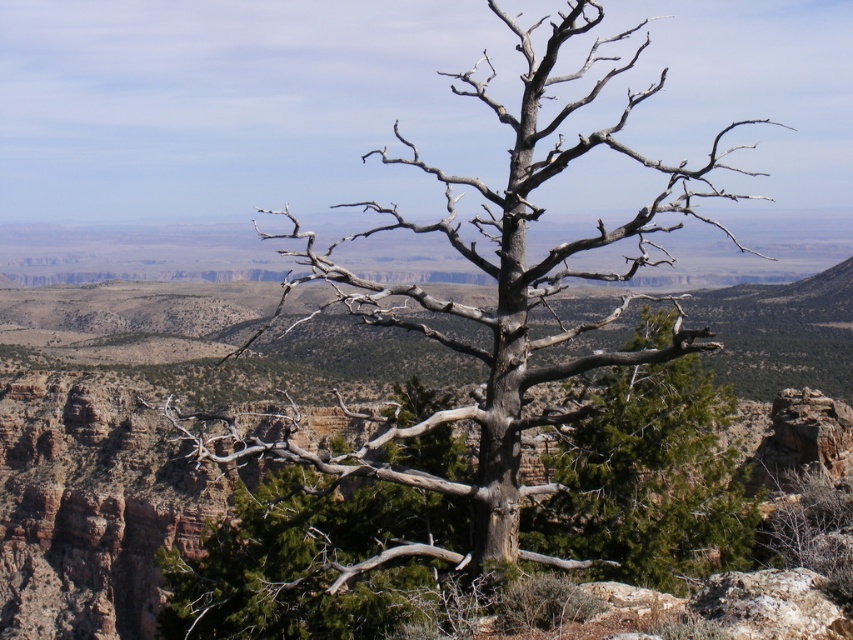
Can you confirm if brown rocky canyon at center is shorter than gray bark tree at center?

No.

Can you confirm if brown rocky canyon at center is thinner than gray bark tree at center?

In fact, brown rocky canyon at center might be wider than gray bark tree at center.

Who is more distant from viewer, (746, 388) or (683, 497)?

Positioned behind is point (746, 388).

This screenshot has width=853, height=640. What are the coordinates of `brown rocky canyon at center` in the screenshot? It's located at (144, 432).